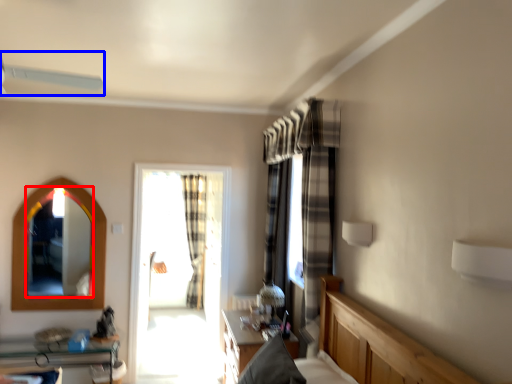
Question: Among these objects, which one is farthest to the camera, mirror (highlighted by a red box) or fan (highlighted by a blue box)?

Choices:
 (A) mirror
 (B) fan

Answer: (A)